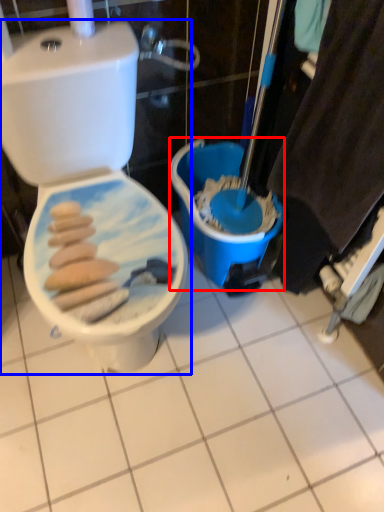
Question: Which object appears farthest to the camera in this image, potty (highlighted by a red box) or toilet (highlighted by a blue box)?

Choices:
 (A) potty
 (B) toilet

Answer: (A)